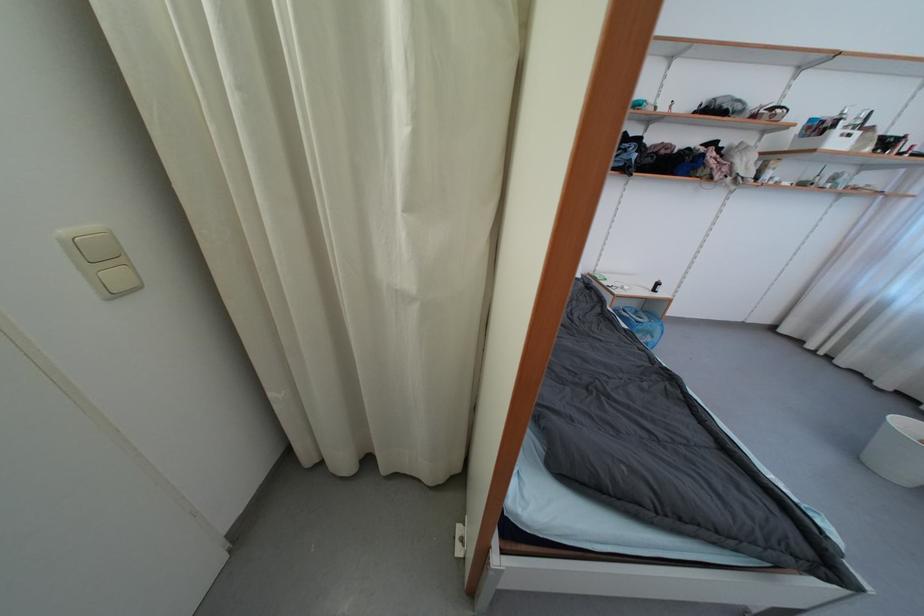
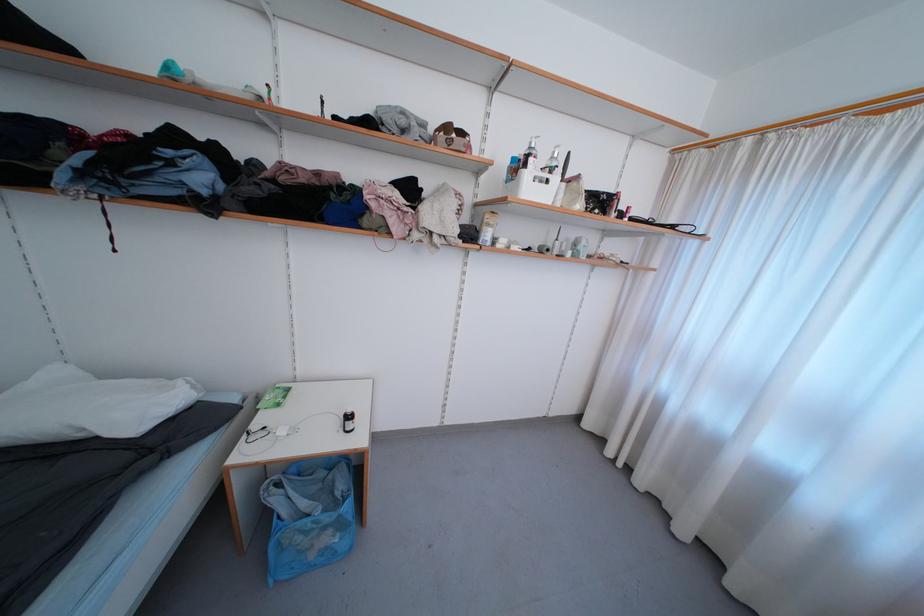
Where in the second image is the point corresponding to point (872, 151) from the first image?

(584, 208)